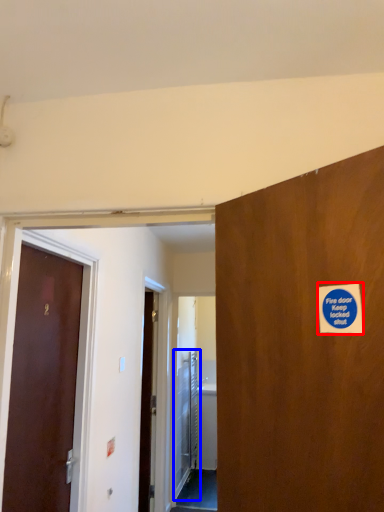
Question: Which object appears closest to the camera in this image, sticker (highlighted by a red box) or elevator door (highlighted by a blue box)?

Choices:
 (A) sticker
 (B) elevator door

Answer: (A)